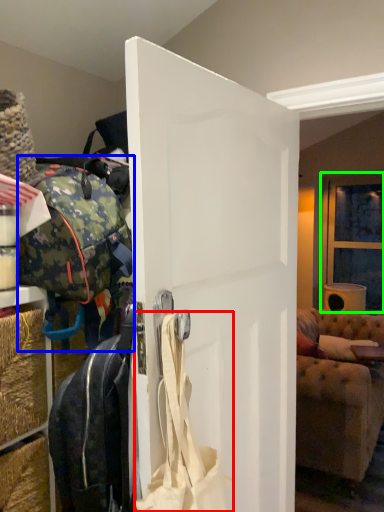
Question: Which is nearer to the shoulder bag (highlighted by a red box)? luggage and bags (highlighted by a blue box) or window (highlighted by a green box).

Choices:
 (A) luggage and bags
 (B) window

Answer: (A)